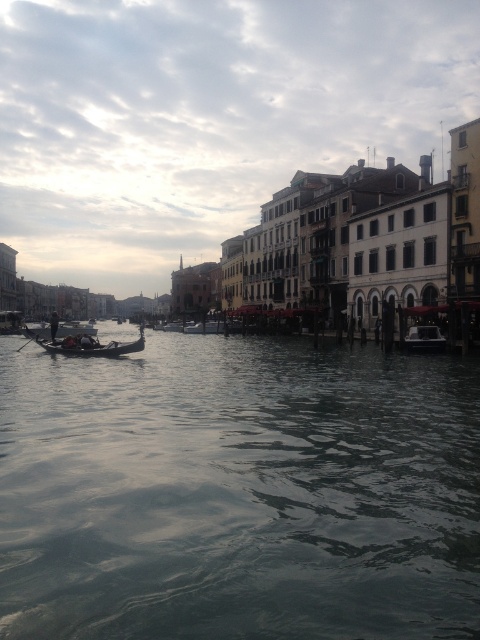
You are a tourist standing on the canal bridge and want to take a photo of the wooden gondola at center and the dark gray water at center. Which one is wider in the image?

The dark gray water at center is wider than the wooden gondola at center according to the description.

You are planning to cross the canal using a small boat that is 15 meters long. You see the dark gray water at center and the wooden gondola at center. Can your boat fit between them without touching either?

The distance between dark gray water at center and wooden gondola at center is 17.18 meters, so a 15 meter boat can fit between them without touching either.

You are standing on a bridge overlooking the canal and see the wooden gondola at center and the dark blue fabric person at left. Which object appears larger in the scene?

The dark blue fabric person at left appears larger than the wooden gondola at center in the scene.